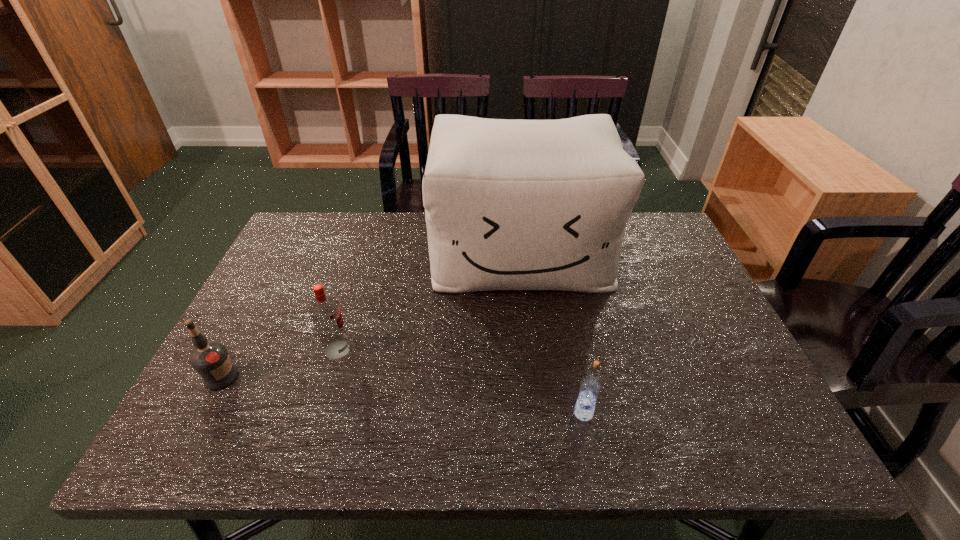
Where is `free spot located 0.350m on the front label of the third farthest object`? The image size is (960, 540). free spot located 0.350m on the front label of the third farthest object is located at coordinates (398, 377).

I want to click on vacant space located 0.140m on the right of the nearest object, so click(662, 413).

At what (x,y) coordinates should I click in order to perform the action: click on object that is at the far edge. Please return your answer as a coordinate pair (x, y). The image size is (960, 540). Looking at the image, I should click on (518, 204).

At what (x,y) coordinates should I click in order to perform the action: click on object at the near edge. Please return your answer as a coordinate pair (x, y). This screenshot has height=540, width=960. Looking at the image, I should click on (590, 387).

Locate an element on the screen. object present at the left edge is located at coordinates (210, 360).

In the image, there is a desktop. Identify the location of free space at the far edge. (384, 249).

Where is `free space at the near edge of the desktop`? This screenshot has height=540, width=960. free space at the near edge of the desktop is located at coordinates (428, 429).

Where is `vacant space at the left edge of the desktop`? vacant space at the left edge of the desktop is located at coordinates (315, 270).

The height and width of the screenshot is (540, 960). What are the coordinates of `free space at the right edge of the desktop` in the screenshot? It's located at (656, 274).

The height and width of the screenshot is (540, 960). What are the coordinates of `free space at the far left corner` in the screenshot? It's located at (316, 218).